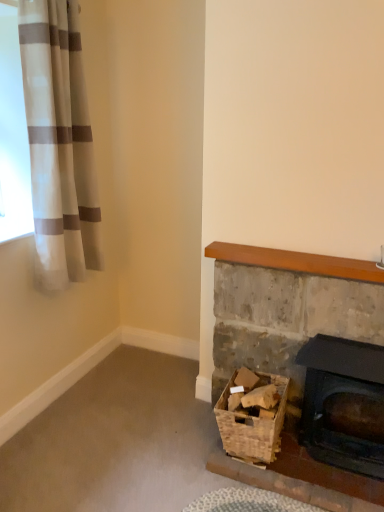
In order to click on vacant area situated to the left side of matte black fireplace at lower right, the first fireplace in the right-to-left sequence in this screenshot , I will do `click(288, 479)`.